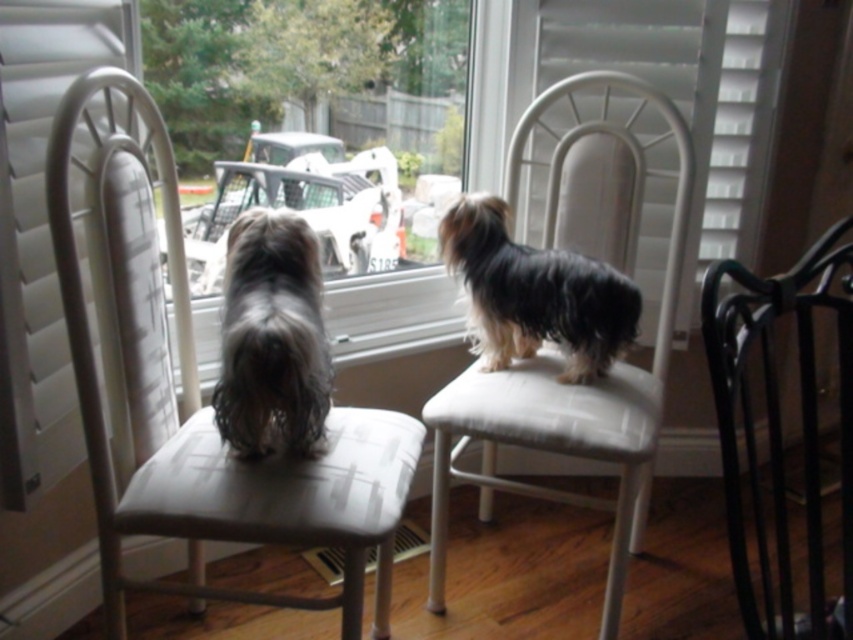
Question: Which object appears closest to the camera in this image?

Choices:
 (A) black metal chair at lower right
 (B) shiny black fur at center

Answer: (A)

Question: Considering the relative positions of matte gray chair at left and white fabric stool at center in the image provided, where is matte gray chair at left located with respect to white fabric stool at center?

Choices:
 (A) right
 (B) left

Answer: (B)

Question: Which point is farther to the camera?

Choices:
 (A) (515, 272)
 (B) (746, 304)
 (C) (486, 412)

Answer: (A)

Question: Is transparent glass window at center bigger than black metal chair at lower right?

Choices:
 (A) no
 (B) yes

Answer: (A)

Question: Estimate the real-world distances between objects in this image. Which object is farther from the matte gray chair at left?

Choices:
 (A) black metal chair at lower right
 (B) shaggy brown fur at left
 (C) transparent glass window at center

Answer: (A)

Question: Considering the relative positions of white fabric chair at center and shiny black fur at center in the image provided, where is white fabric chair at center located with respect to shiny black fur at center?

Choices:
 (A) left
 (B) right

Answer: (B)